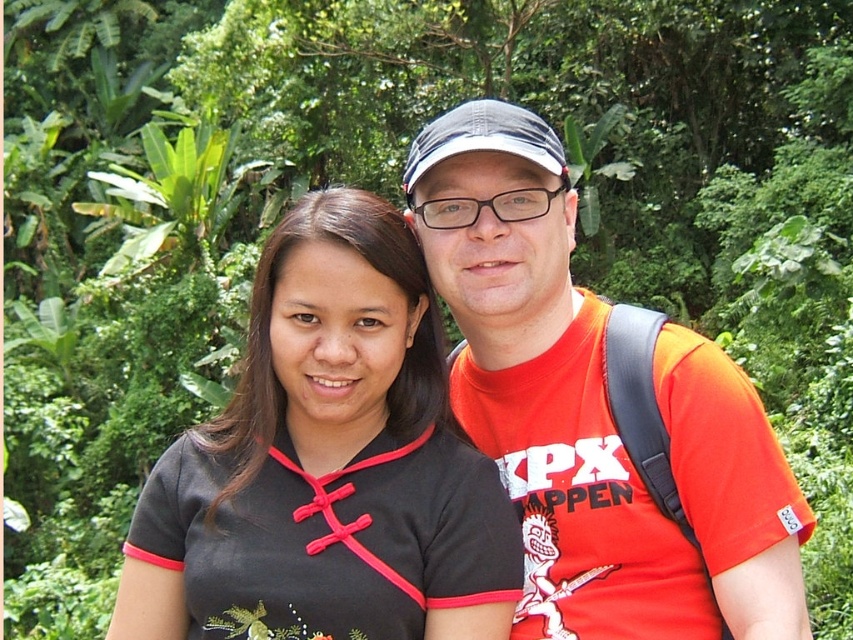
How much distance is there between black matte shirt at center and orange cotton t-shirt at center?

black matte shirt at center is 19.92 inches from orange cotton t-shirt at center.

What do you see at coordinates (328, 465) in the screenshot? I see `black matte shirt at center` at bounding box center [328, 465].

Does point (460, 442) come closer to viewer compared to point (532, 593)?

Yes.

I want to click on black matte shirt at center, so click(x=328, y=465).